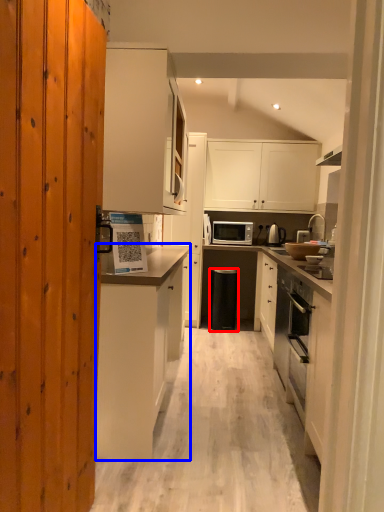
Question: Which object is closer to the camera taking this photo, trash bin/can (highlighted by a red box) or cabinetry (highlighted by a blue box)?

Choices:
 (A) trash bin/can
 (B) cabinetry

Answer: (B)